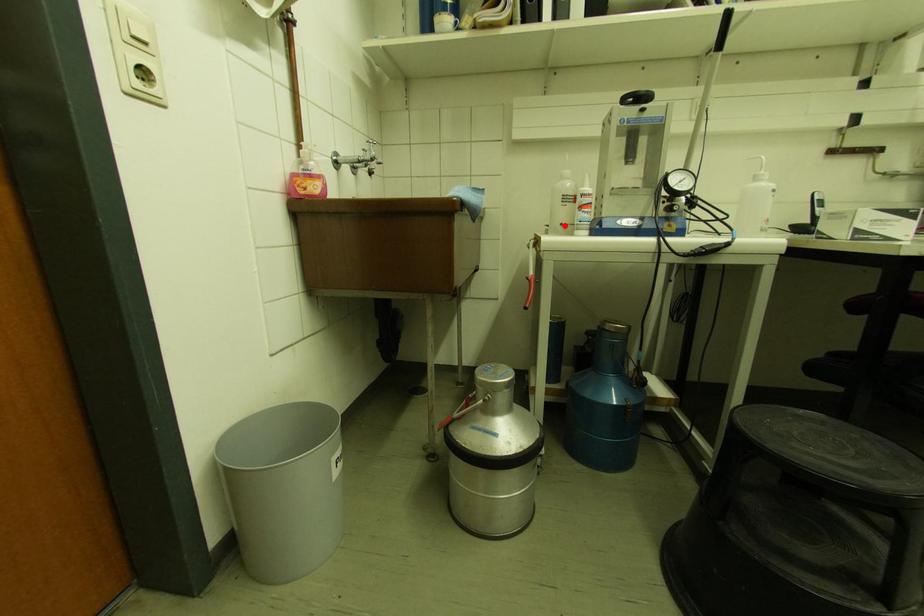
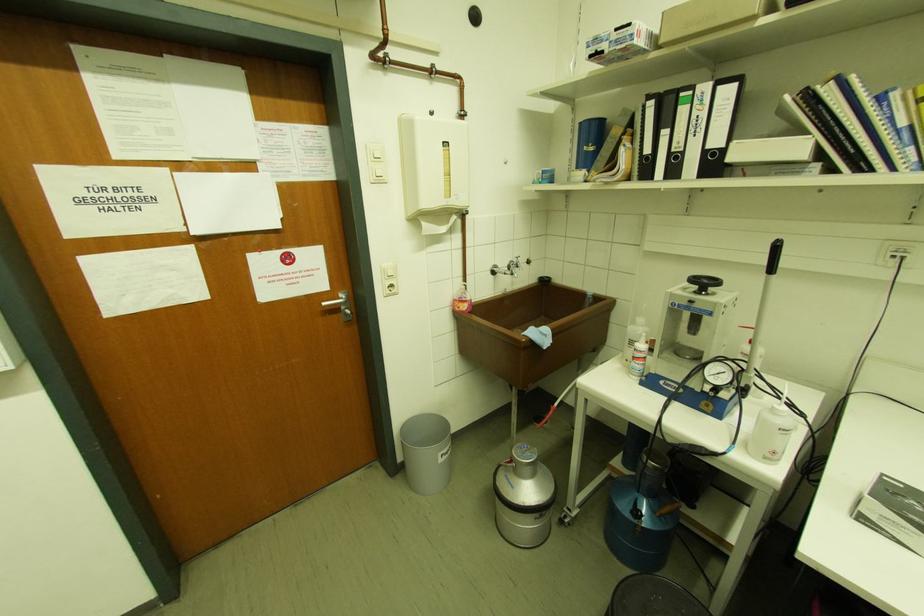
In the second image, find the point that corresponds to the highlighted location in the first image.

(629, 362)